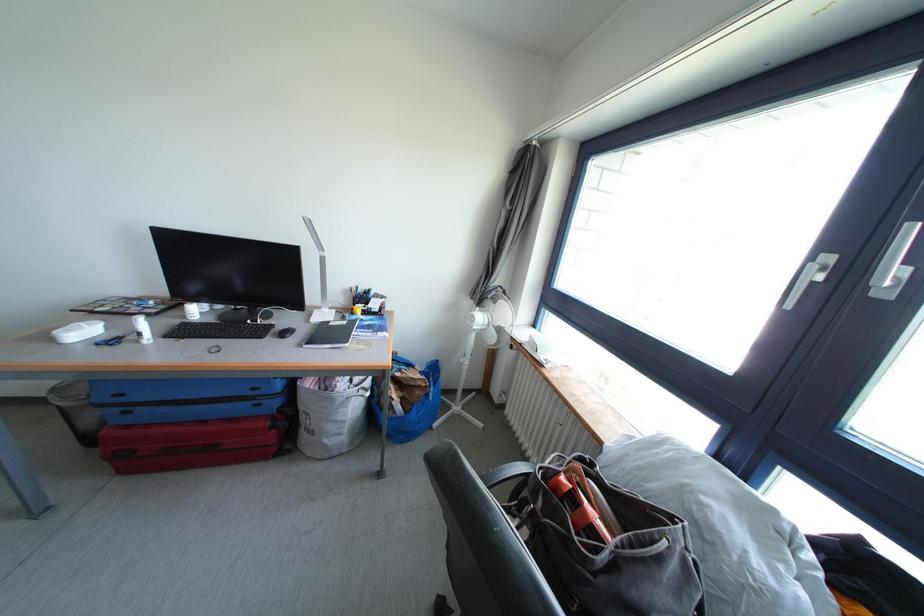
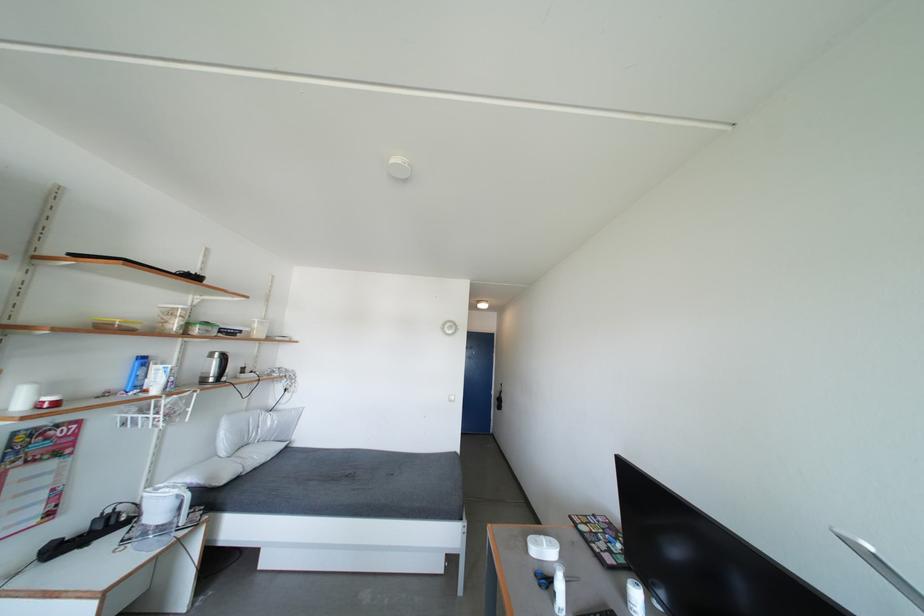
In the second image, find the point that corresponds to pixel 153 313 in the first image.

(616, 556)